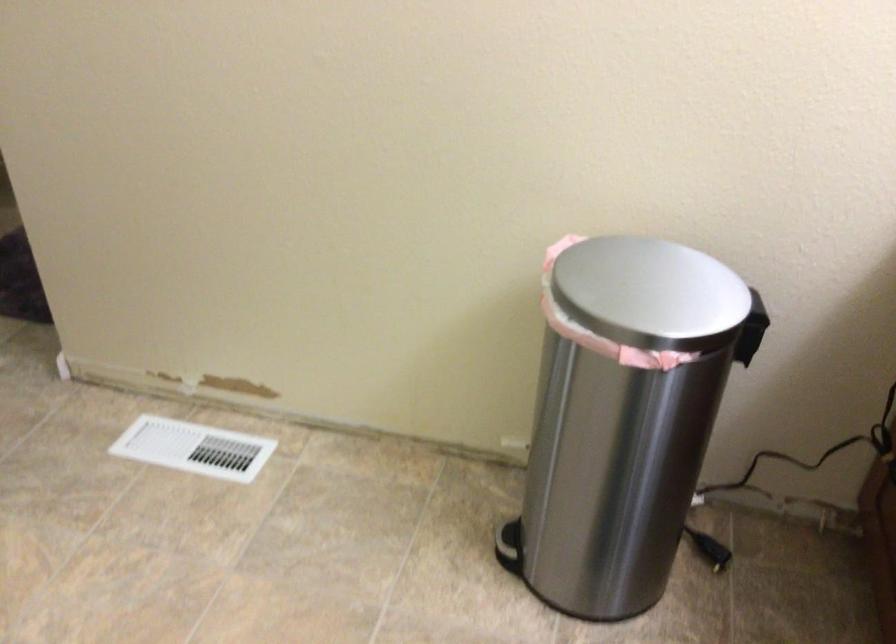
Identify the location of black trash can pedal. The width and height of the screenshot is (896, 644). (750, 337).